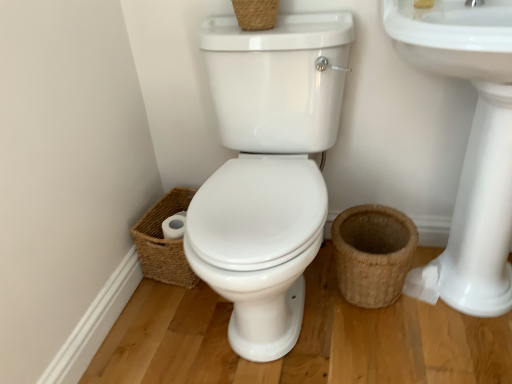
Find the location of a particular element. The width and height of the screenshot is (512, 384). free space underneath white glossy sink at upper right, which appears as the second sink when viewed from the right (from a real-world perspective) is located at coordinates (287, 343).